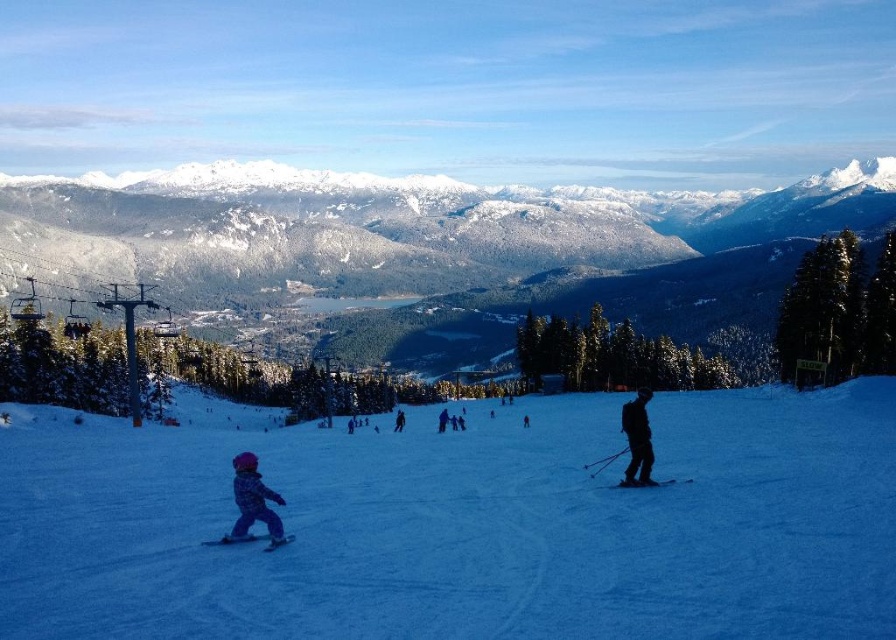
Question: Which of the following is the farthest from the observer?

Choices:
 (A) (237, 538)
 (B) (278, 525)
 (C) (618, 484)
 (D) (521, 259)

Answer: (D)

Question: Is snowy forested mountain at upper center further to the viewer compared to purple snowsuit at lower left?

Choices:
 (A) no
 (B) yes

Answer: (B)

Question: Is white snow ski slope at lower left bigger than snowy forested mountain at upper center?

Choices:
 (A) yes
 (B) no

Answer: (B)

Question: Estimate the real-world distances between objects in this image. Which object is farther from the dark blue ski suit at center?

Choices:
 (A) purple snowsuit at lower left
 (B) dark blue snowsuit at center

Answer: (A)

Question: Does blue matte ski at lower left appear on the right side of black matte ski at center?

Choices:
 (A) yes
 (B) no

Answer: (B)

Question: Which point is farther to the camera?

Choices:
 (A) (437, 429)
 (B) (543, 282)
 (C) (518, 522)
 (D) (242, 509)

Answer: (B)